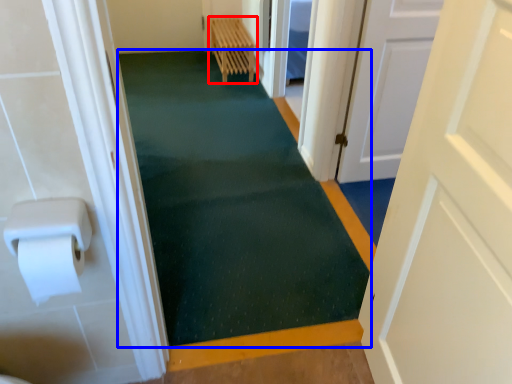
Question: Which object is closer to the camera taking this photo, furniture (highlighted by a red box) or bath mat (highlighted by a blue box)?

Choices:
 (A) furniture
 (B) bath mat

Answer: (B)